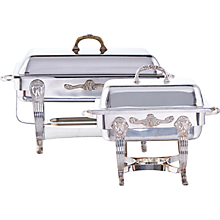
Where is `small chafing dish lid handle`? This screenshot has width=220, height=220. small chafing dish lid handle is located at coordinates (153, 65).